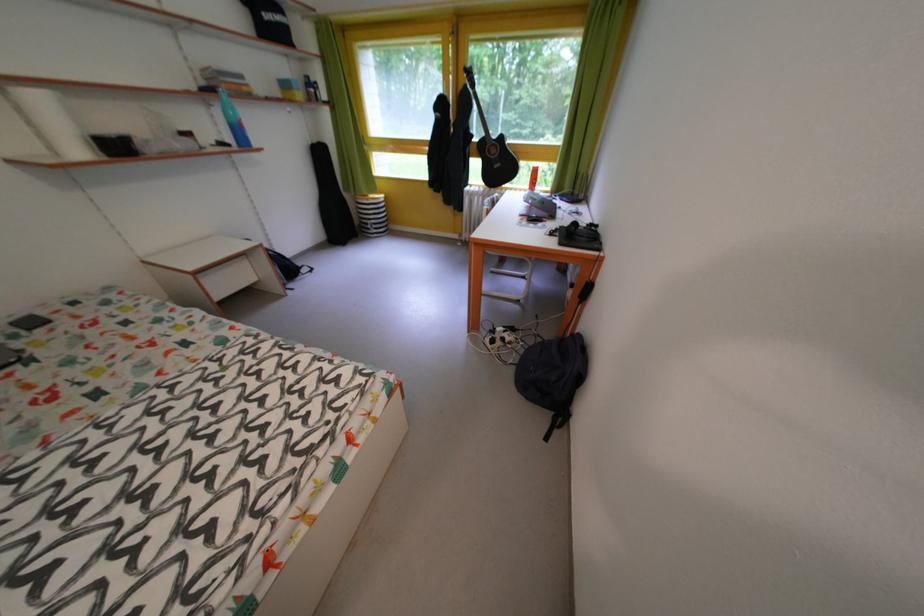
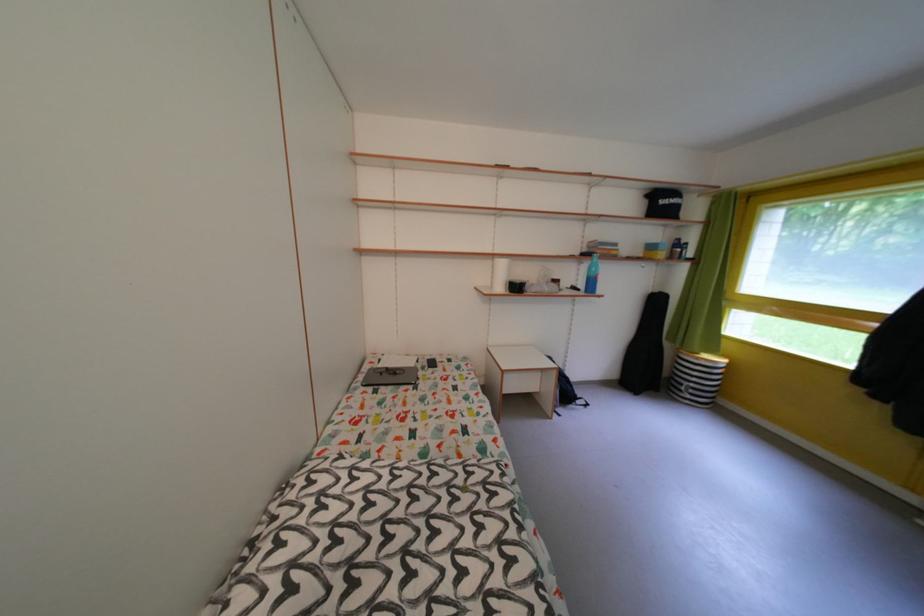
Find the pixel in the second image that matches the point at 196,65 in the first image.

(592, 243)